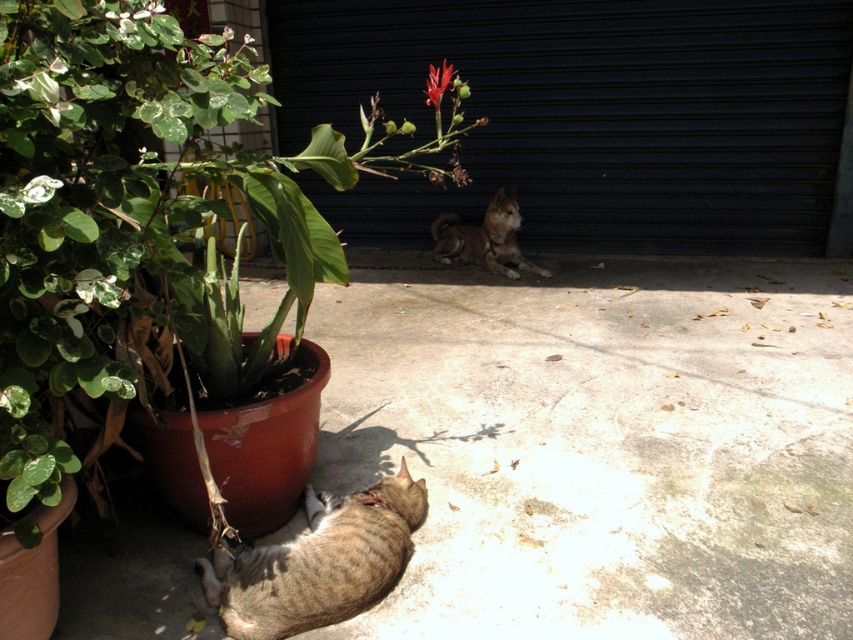
You are a photographer trying to capture both the tabby fur cat at lower left and the vivid red petal at upper center in a single shot. Based on their positions, which one would appear closer to the camera in the photo?

The tabby fur cat at lower left appears closer to the camera because it has a lesser height compared to the vivid red petal at upper center.